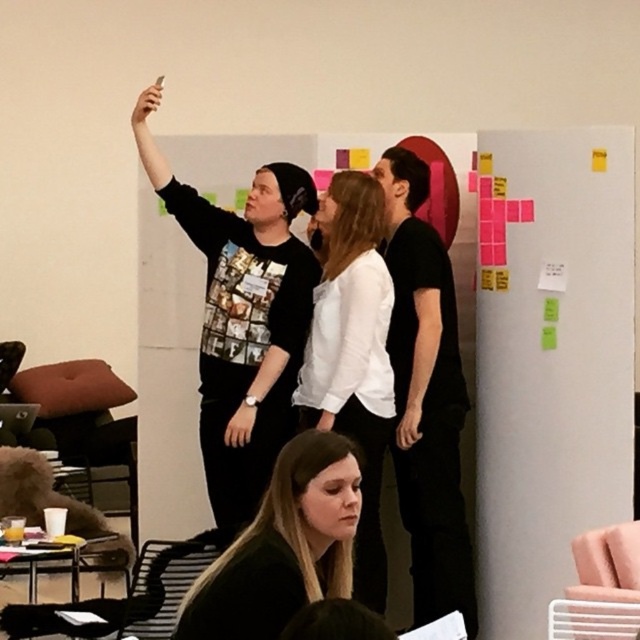
How much distance is there between black matte shirt at center and white matte shirt at center?

A distance of 35.70 centimeters exists between black matte shirt at center and white matte shirt at center.

Who is lower down, black matte shirt at center or white matte shirt at center?

white matte shirt at center

This screenshot has height=640, width=640. I want to click on black matte shirt at center, so click(426, 396).

Who is shorter, black matte sweatshirt at upper left or white matte shirt at center?

Standing shorter between the two is white matte shirt at center.

Is black matte sweatshirt at upper left smaller than white matte shirt at center?

No.

Which is behind, point (208, 417) or point (368, 454)?

Positioned behind is point (208, 417).

Find the location of `black matte sweatshirt at upper left`. black matte sweatshirt at upper left is located at coordinates (243, 317).

In the scene shown: Is black matte sweatshirt at upper left positioned in front of black matte shirt at center?

Yes, black matte sweatshirt at upper left is in front of black matte shirt at center.

Can you confirm if black matte sweatshirt at upper left is shorter than black matte shirt at center?

Yes.

Is point (289, 243) more distant than point (417, 250)?

Yes, point (289, 243) is behind point (417, 250).

In order to click on black matte sweatshirt at upper left in this screenshot , I will do `click(243, 317)`.